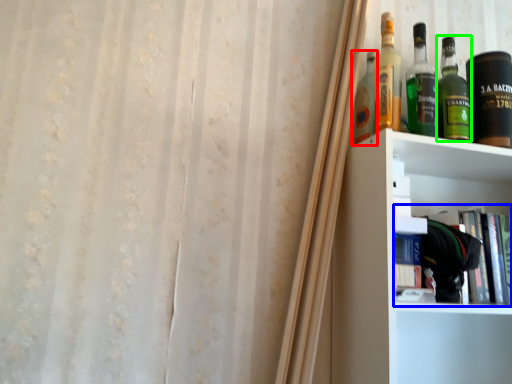
Question: Based on their relative distances, which object is farther from bottle (highlighted by a red box)? Choose from book (highlighted by a blue box) and bottle (highlighted by a green box).

Choices:
 (A) book
 (B) bottle

Answer: (A)